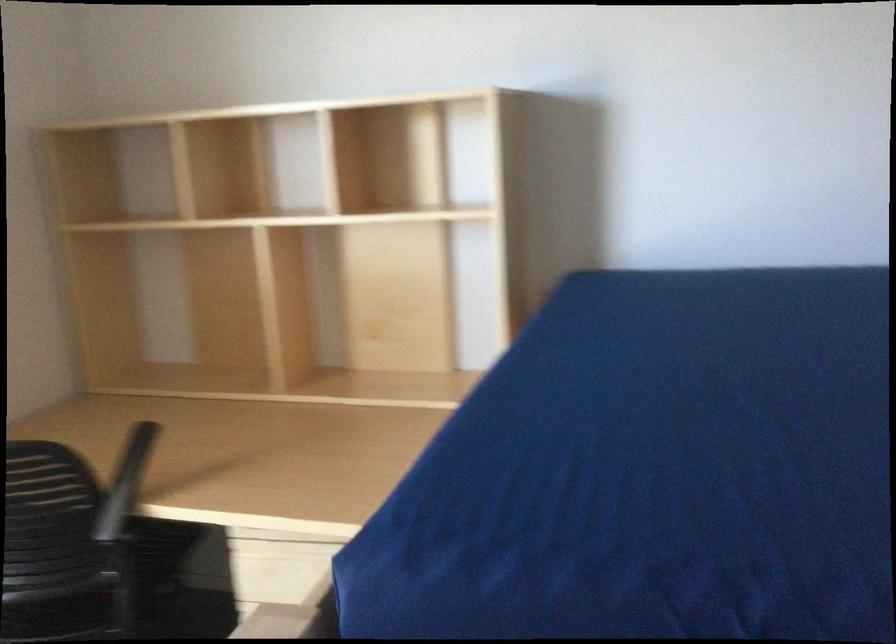
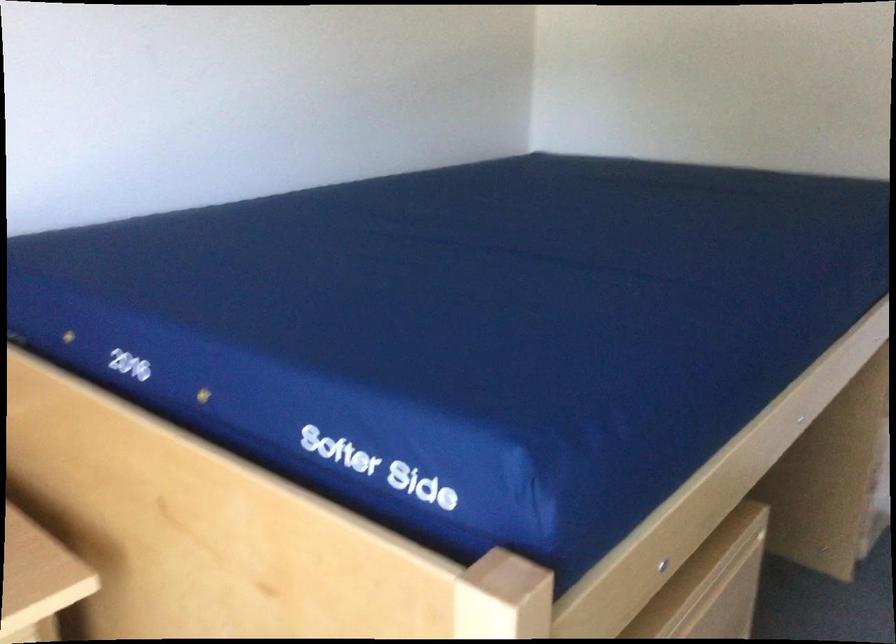
Question: Based on the continuous images, in which direction is the camera rotating? Reply with the corresponding letter.

Choices:
 (A) Left
 (B) Right
 (C) Up
 (D) Down

Answer: (B)